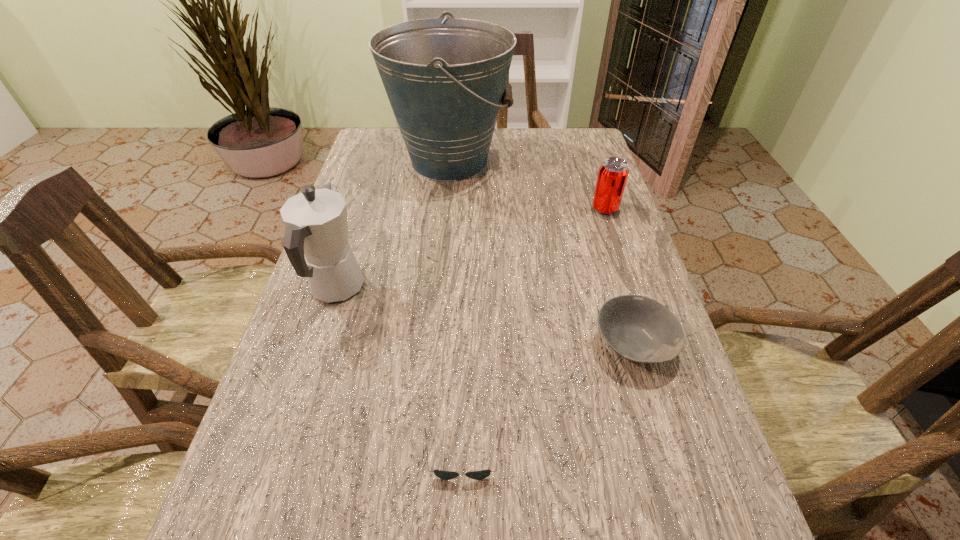
Locate an element on the screen. Image resolution: width=960 pixels, height=540 pixels. free space in the image that satisfies the following two spatial constraints: 1. on the back side of the bowl; 2. on the left side of the soda can is located at coordinates tap(592, 208).